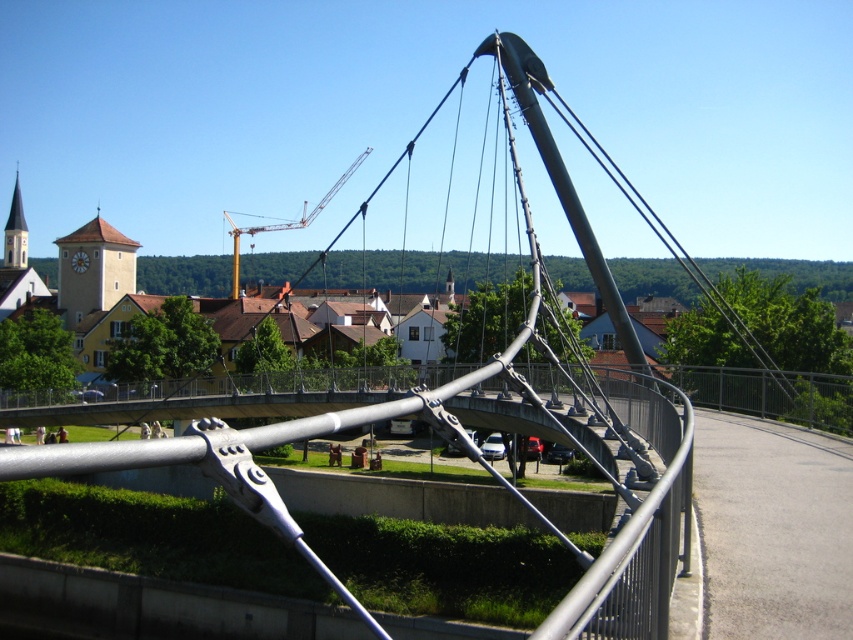
Question: Which point is closer to the camera taking this photo?

Choices:
 (A) [x=614, y=572]
 (B) [x=265, y=227]

Answer: (A)

Question: Does polished steel bridge at center have a greater width compared to yellow metallic crane at upper center?

Choices:
 (A) yes
 (B) no

Answer: (B)

Question: Which object is closer to the camera taking this photo?

Choices:
 (A) yellow metallic crane at upper center
 (B) polished steel bridge at center

Answer: (B)

Question: Can you confirm if polished steel bridge at center is positioned to the right of yellow metallic crane at upper center?

Choices:
 (A) no
 (B) yes

Answer: (B)

Question: Which object appears farthest from the camera in this image?

Choices:
 (A) yellow metallic crane at upper center
 (B) polished steel bridge at center

Answer: (A)

Question: Can you confirm if polished steel bridge at center is positioned to the left of yellow metallic crane at upper center?

Choices:
 (A) no
 (B) yes

Answer: (A)